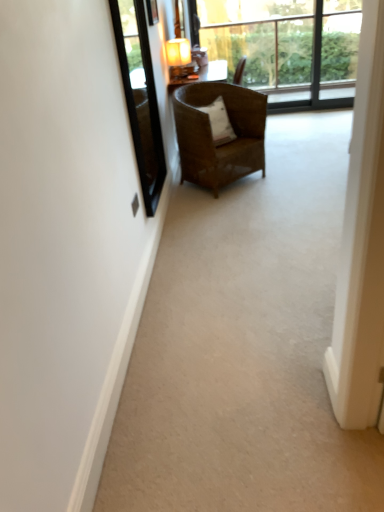
Where is `vacant point to the left of white glossy screen door at right`? vacant point to the left of white glossy screen door at right is located at coordinates (296, 465).